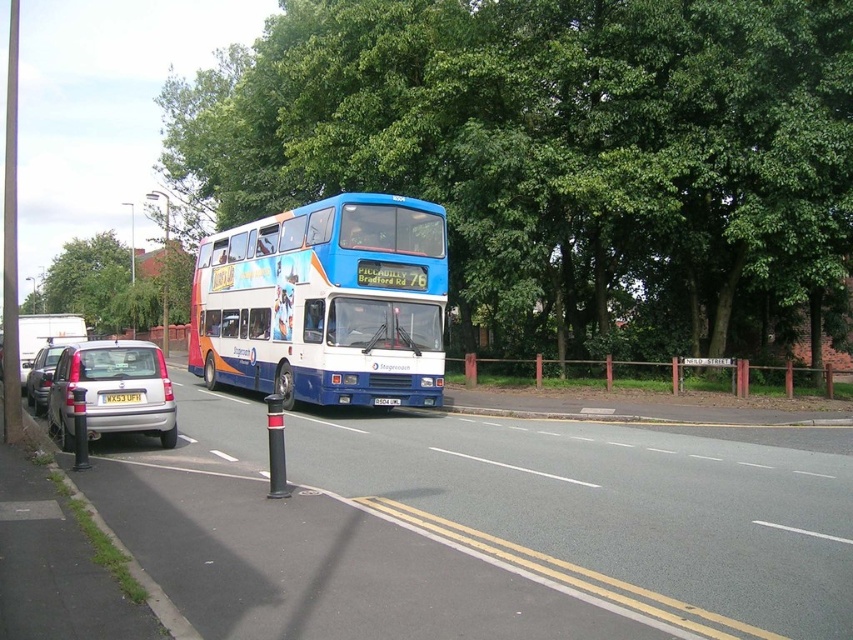
Does green leafy tree at center appear on the right side of silver metallic hatchback at lower left?

No, green leafy tree at center is not to the right of silver metallic hatchback at lower left.

Which is behind, point (689, 292) or point (141, 404)?

Point (689, 292)

Describe the element at coordinates (558, 154) in the screenshot. I see `green leafy tree at center` at that location.

The height and width of the screenshot is (640, 853). Identify the location of green leafy tree at center. (558, 154).

Based on the photo, which is more to the left, blue painted decker bus at center or silver metallic hatchback at lower left?

silver metallic hatchback at lower left is more to the left.

Which is more to the right, blue painted decker bus at center or silver metallic hatchback at lower left?

Positioned to the right is blue painted decker bus at center.

The height and width of the screenshot is (640, 853). What do you see at coordinates (325, 301) in the screenshot?
I see `blue painted decker bus at center` at bounding box center [325, 301].

I want to click on blue painted decker bus at center, so click(325, 301).

Based on the photo, is green leafy tree at center above silver metallic hatchback at left?

Yes, green leafy tree at center is above silver metallic hatchback at left.

Which is more to the left, green leafy tree at center or silver metallic hatchback at left?

green leafy tree at center is more to the left.

Which is in front, point (653, 220) or point (49, 368)?

Point (49, 368) is more forward.

Find the location of a particular element. This screenshot has width=853, height=640. green leafy tree at center is located at coordinates (558, 154).